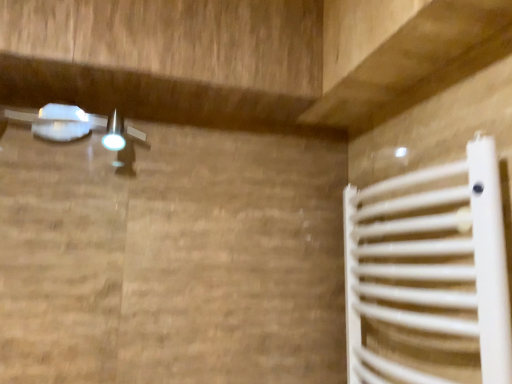
Question: Should I look upward or downward to see white matte radiator at lower right?

Choices:
 (A) down
 (B) up

Answer: (A)